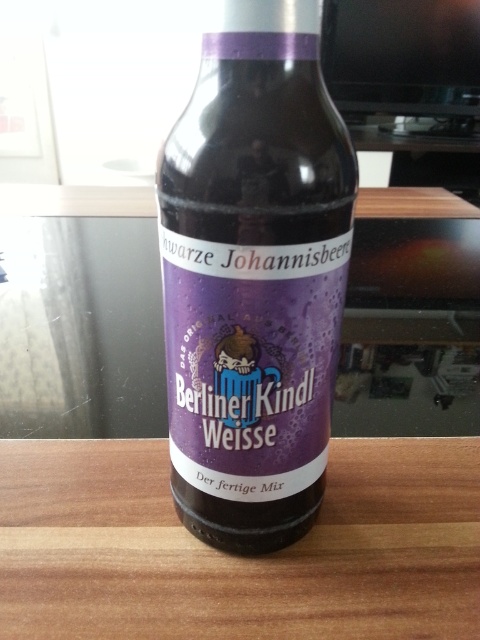
Question: Does matte glass bottle at center lie behind wooden table at center?

Choices:
 (A) yes
 (B) no

Answer: (B)

Question: Which of the following is the farthest from the observer?

Choices:
 (A) wooden table at center
 (B) matte glass bottle at center

Answer: (A)

Question: Does matte glass bottle at center appear under wooden table at center?

Choices:
 (A) yes
 (B) no

Answer: (B)

Question: Can you confirm if matte glass bottle at center is smaller than wooden table at center?

Choices:
 (A) no
 (B) yes

Answer: (B)